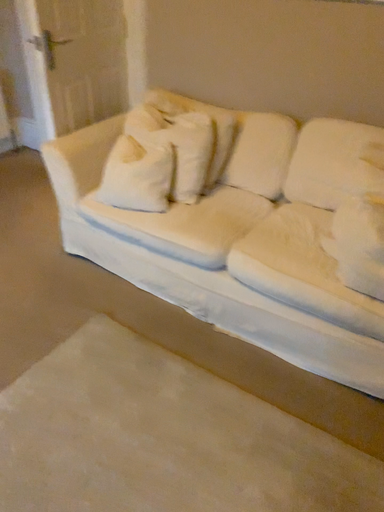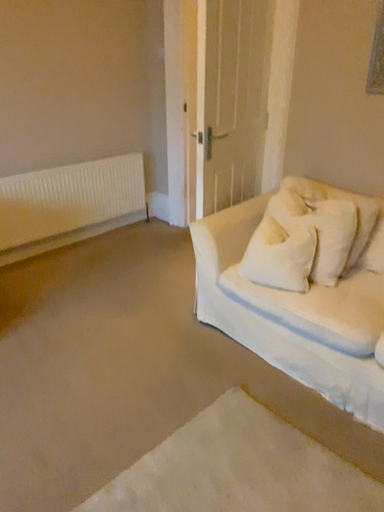
Question: How did the camera likely rotate when shooting the video?

Choices:
 (A) rotated upward
 (B) rotated downward

Answer: (A)